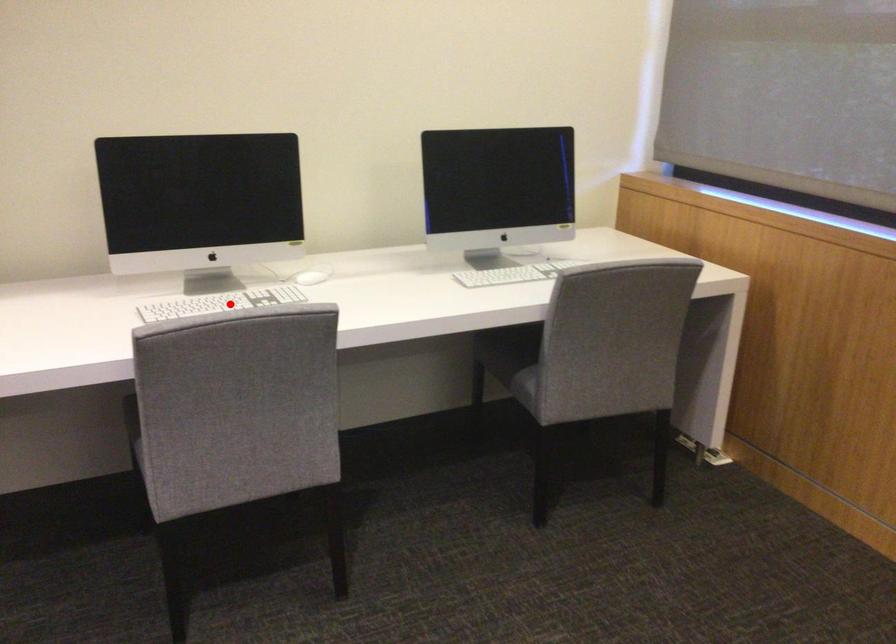
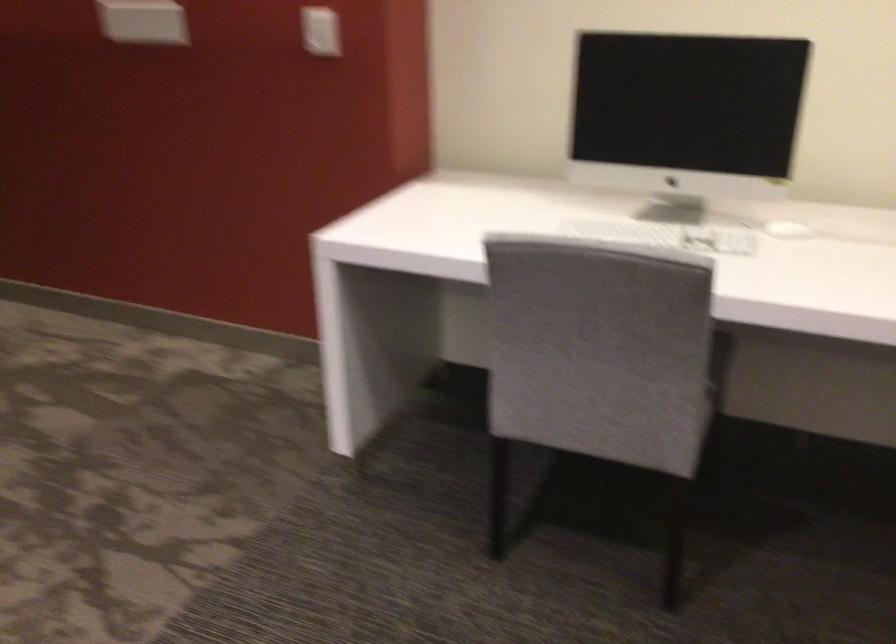
In the second image, find the point that corresponds to the highlighted location in the first image.

(666, 234)